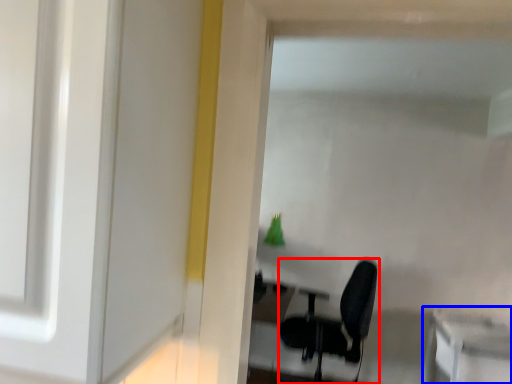
Question: Which point is closer to the camera, chair (highlighted by a red box) or table (highlighted by a blue box)?

Choices:
 (A) chair
 (B) table

Answer: (B)